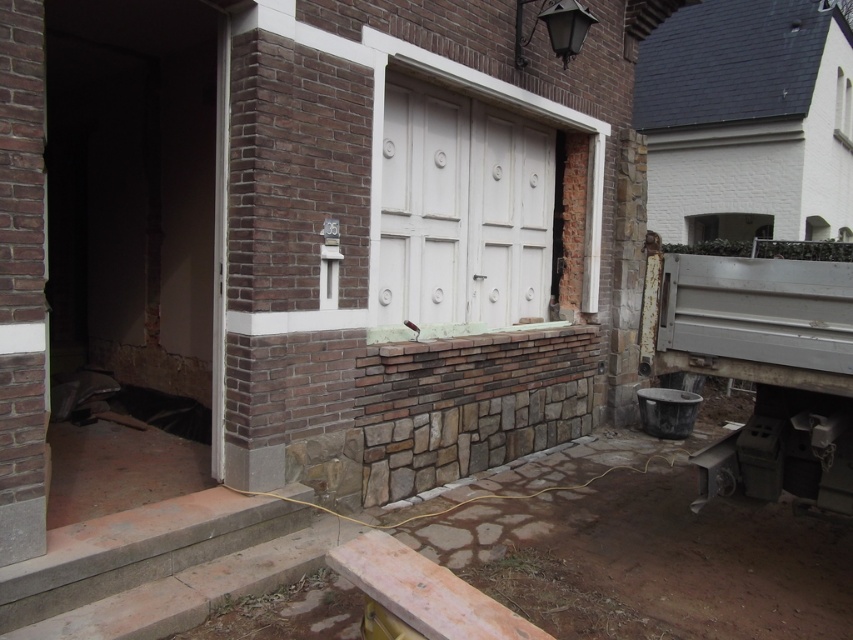
Between point (508, 321) and point (839, 131), which one is positioned in front?

Positioned in front is point (508, 321).

Describe the element at coordinates (462, 211) in the screenshot. I see `white painted wood door at center` at that location.

Between point (428, 310) and point (842, 138), which one is positioned in front?

Point (428, 310) is more forward.

The height and width of the screenshot is (640, 853). I want to click on white painted wood door at center, so click(462, 211).